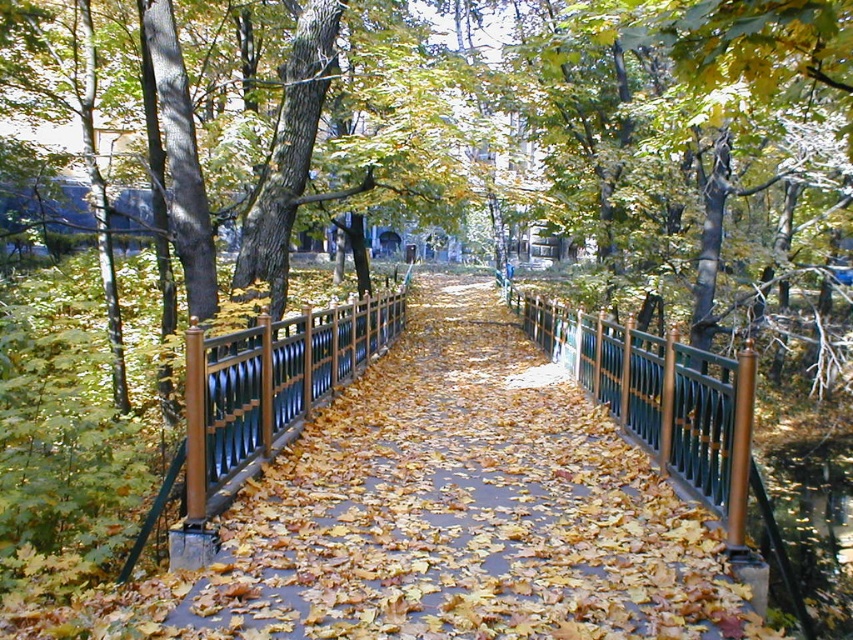
Question: Is metallic green fence at center above green metal fence at center?

Choices:
 (A) no
 (B) yes

Answer: (A)

Question: Which point is farther to the camera?

Choices:
 (A) metallic green fence at center
 (B) green metal fence at center

Answer: (B)

Question: Which of the following is the farthest from the observer?

Choices:
 (A) metallic green fence at center
 (B) green metal fence at center

Answer: (B)

Question: Does metallic green fence at center appear over green metal fence at center?

Choices:
 (A) yes
 (B) no

Answer: (B)

Question: Which object is farther from the camera taking this photo?

Choices:
 (A) green metal fence at center
 (B) metallic green fence at center

Answer: (A)

Question: Does metallic green fence at center appear on the left side of green metal fence at center?

Choices:
 (A) no
 (B) yes

Answer: (A)